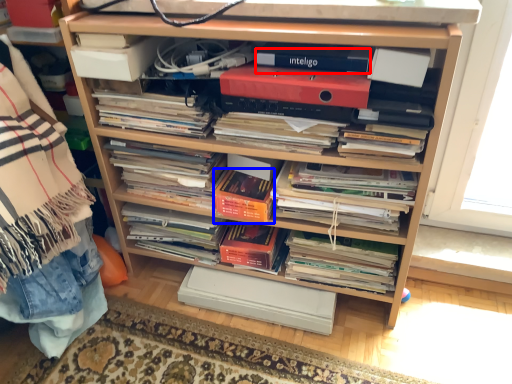
Question: Which object is closer to the camera taking this photo, paperback book (highlighted by a red box) or paperback book (highlighted by a blue box)?

Choices:
 (A) paperback book
 (B) paperback book

Answer: (A)